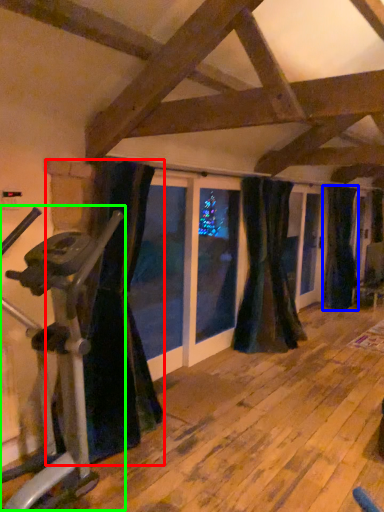
Question: Which object is the closest to the curtain (highlighted by a red box)? Choose among these: curtain (highlighted by a blue box) or stationary bicycle (highlighted by a green box).

Choices:
 (A) curtain
 (B) stationary bicycle

Answer: (B)